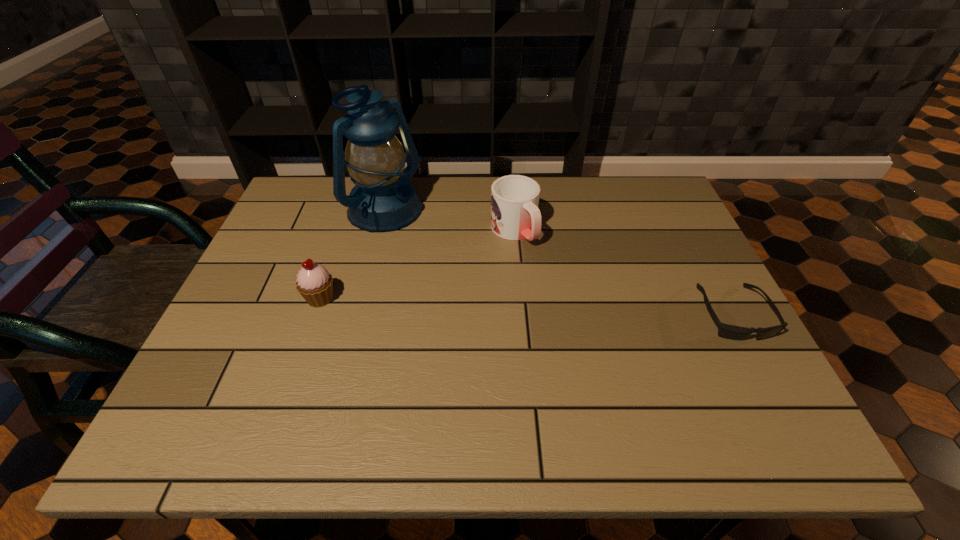
Locate an element on the screen. The image size is (960, 540). free spot at the right edge of the desktop is located at coordinates (666, 325).

This screenshot has width=960, height=540. In order to click on free space at the far left corner in this screenshot , I will do `click(308, 193)`.

Image resolution: width=960 pixels, height=540 pixels. In the image, there is a desktop. Identify the location of free space at the far right corner. (626, 200).

At what (x,y) coordinates should I click in order to perform the action: click on vacant region at the near right corner of the desktop. Please return your answer as a coordinate pair (x, y). Image resolution: width=960 pixels, height=540 pixels. Looking at the image, I should click on click(x=753, y=380).

Locate an element on the screen. vacant point located between the cupcake and the third object from left to right is located at coordinates click(417, 265).

Find the location of a particular element. vacant point located between the cupcake and the lantern is located at coordinates (352, 256).

You are a GUI agent. You are given a task and a screenshot of the screen. Output one action in this format:
    pyautogui.click(x=<x>, y=<y>)
    Task: Click on the vacant point located between the rightmost object and the second object from right to left
    Image resolution: width=960 pixels, height=540 pixels.
    Given the screenshot: What is the action you would take?
    pyautogui.click(x=623, y=272)

This screenshot has height=540, width=960. In order to click on vacant space that is in between the lantern and the sunglasses in this screenshot , I will do `click(559, 264)`.

Locate an element on the screen. The height and width of the screenshot is (540, 960). vacant area that lies between the rightmost object and the mug is located at coordinates (623, 272).

Where is `vacant space that is in between the lantern and the mug`? vacant space that is in between the lantern and the mug is located at coordinates (448, 222).